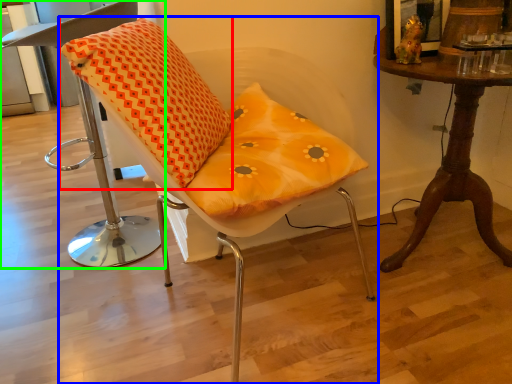
Question: Which is farther away from throw pillow (highlighted by a red box)? chair (highlighted by a blue box) or chair (highlighted by a green box)?

Choices:
 (A) chair
 (B) chair

Answer: (B)